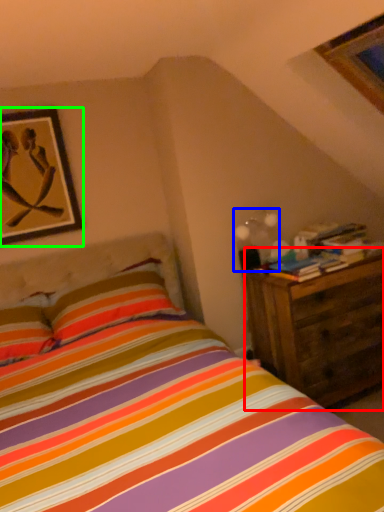
Question: Which object is positioned closest to nightstand (highlighted by a red box)? Select from light fixture (highlighted by a blue box) and picture frame (highlighted by a green box).

Choices:
 (A) light fixture
 (B) picture frame

Answer: (A)